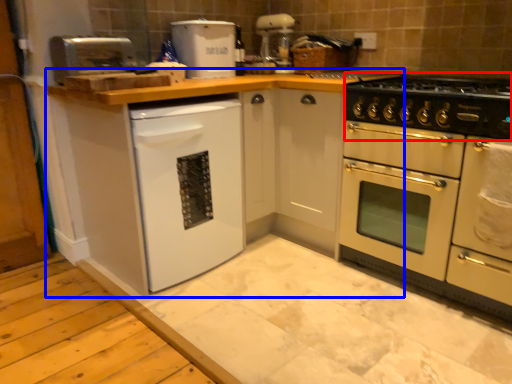
Question: Which object is closer to the camera taking this photo, gas stove (highlighted by a red box) or cabinetry (highlighted by a blue box)?

Choices:
 (A) gas stove
 (B) cabinetry

Answer: (B)